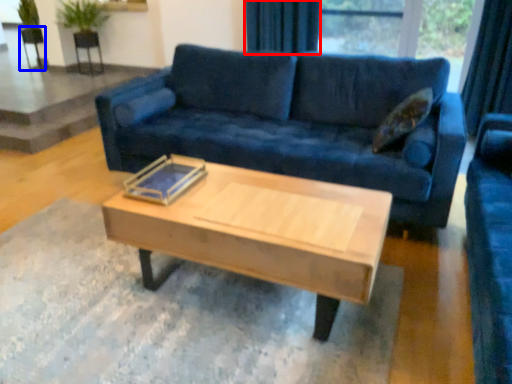
Question: Which point is closer to the camera, curtain (highlighted by a red box) or armchair (highlighted by a blue box)?

Choices:
 (A) curtain
 (B) armchair

Answer: (A)